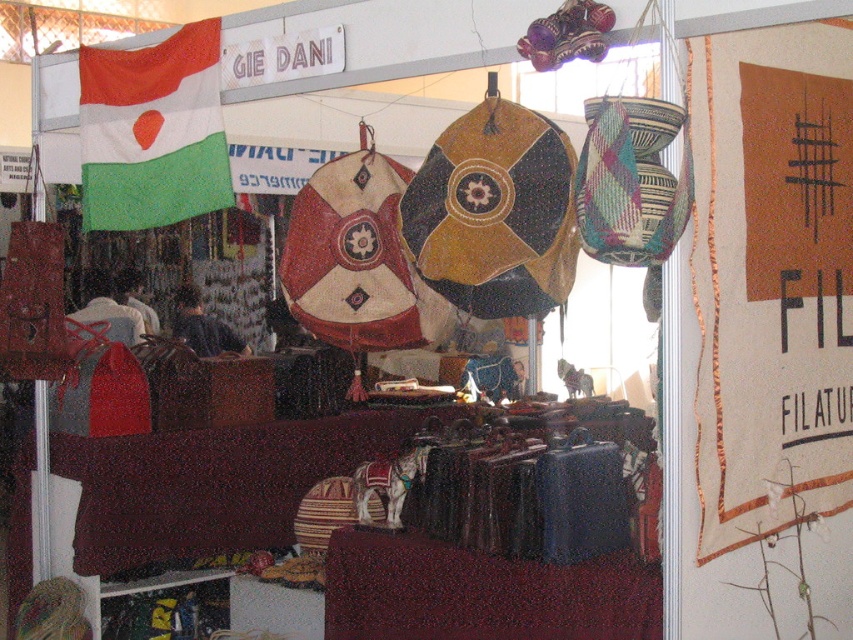
You are standing in front of the market display and want to know which of the two points is nearer to you. Which point is closer to you, point (706, 170) or point (113, 76)?

Point (706, 170) is closer to the viewer than point (113, 76).

You are an interior designer planning to hang two fabrics in a client room. The client wants to know which fabric will cover more wall space. Based on the image, which fabric between the brown fabric at upper right and the green fabric flag at upper left is larger?

The brown fabric at upper right is larger in size than the green fabric flag at upper left, so it will cover more wall space.

You are setting up a display and need to know which fabric is narrower between the brown fabric at upper right and the green fabric flag at upper left. Which one is narrower?

The brown fabric at upper right is narrower than the green fabric flag at upper left because it has a lesser width compared to the green fabric flag at upper left.